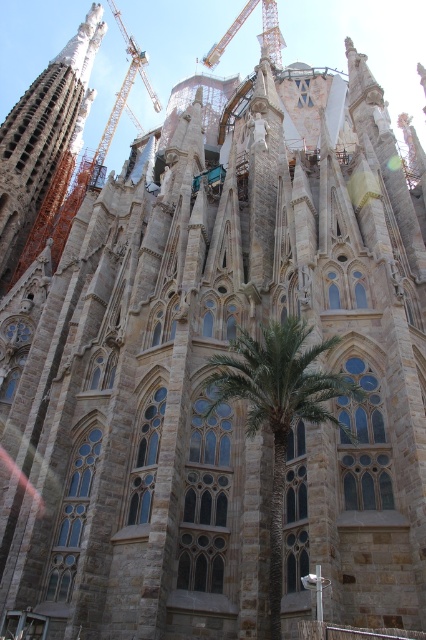
Question: Does stone tower at center lie in front of metallic construction crane at upper center?

Choices:
 (A) yes
 (B) no

Answer: (A)

Question: Is green leafy palm tree at center below stone tower at center?

Choices:
 (A) yes
 (B) no

Answer: (A)

Question: Which object is closer to the camera taking this photo?

Choices:
 (A) green leafy palm tree at center
 (B) metallic construction crane at upper center
 (C) stone tower at center

Answer: (A)

Question: Among these objects, which one is farthest from the camera?

Choices:
 (A) green leafy palm tree at center
 (B) metallic construction crane at upper center

Answer: (B)

Question: Estimate the real-world distances between objects in this image. Which object is closer to the green leafy palm tree at center?

Choices:
 (A) stone tower at center
 (B) metallic construction crane at upper center

Answer: (A)

Question: Does stone tower at center have a larger size compared to metallic construction crane at upper center?

Choices:
 (A) no
 (B) yes

Answer: (A)